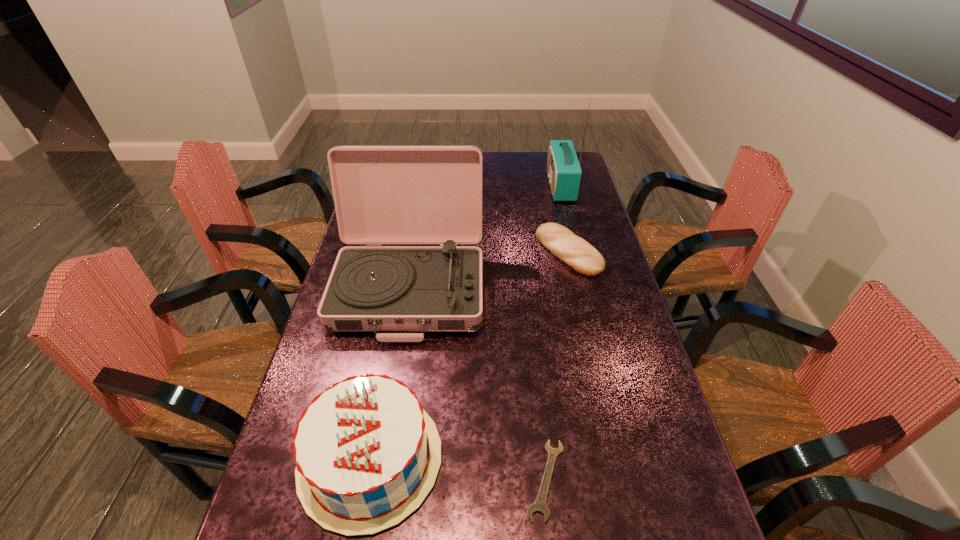
Find the location of a particular element. This screenshot has width=960, height=540. free spot at the left edge of the desktop is located at coordinates (265, 532).

Locate an element on the screen. free space between the second shortest object and the third shortest object is located at coordinates (469, 355).

Where is `free space between the second shortest object and the record player`? The width and height of the screenshot is (960, 540). free space between the second shortest object and the record player is located at coordinates (490, 270).

Identify the location of free space between the record player and the fourth tallest object. Image resolution: width=960 pixels, height=540 pixels. 490,270.

Identify the location of free spot between the third tallest object and the record player. (391, 374).

You are a GUI agent. You are given a task and a screenshot of the screen. Output one action in this format:
    pyautogui.click(x=<x>, y=<y>)
    Task: Click on the free space between the second shortest object and the third tallest object
    This screenshot has height=540, width=960.
    Given the screenshot: What is the action you would take?
    pyautogui.click(x=469, y=355)

This screenshot has height=540, width=960. What are the coordinates of `free space between the radio receiver and the third object from left to right` in the screenshot? It's located at (553, 333).

Locate an element on the screen. Image resolution: width=960 pixels, height=540 pixels. vacant area that lies between the farthest object and the record player is located at coordinates (486, 237).

At what (x,y) coordinates should I click in order to perform the action: click on free space that is in between the third tallest object and the record player. Please return your answer as a coordinate pair (x, y). The image size is (960, 540). Looking at the image, I should click on (391, 374).

The width and height of the screenshot is (960, 540). What are the coordinates of `object that is the second closest to the record player` in the screenshot? It's located at (573, 250).